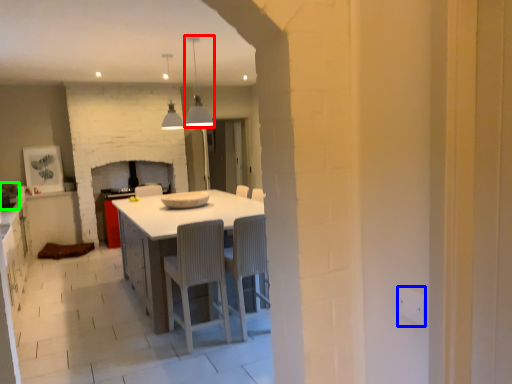
Question: Which object is the farthest from light fixture (highlighted by a red box)? Choose among these: electric outlet (highlighted by a blue box) or appliance (highlighted by a green box).

Choices:
 (A) electric outlet
 (B) appliance

Answer: (A)